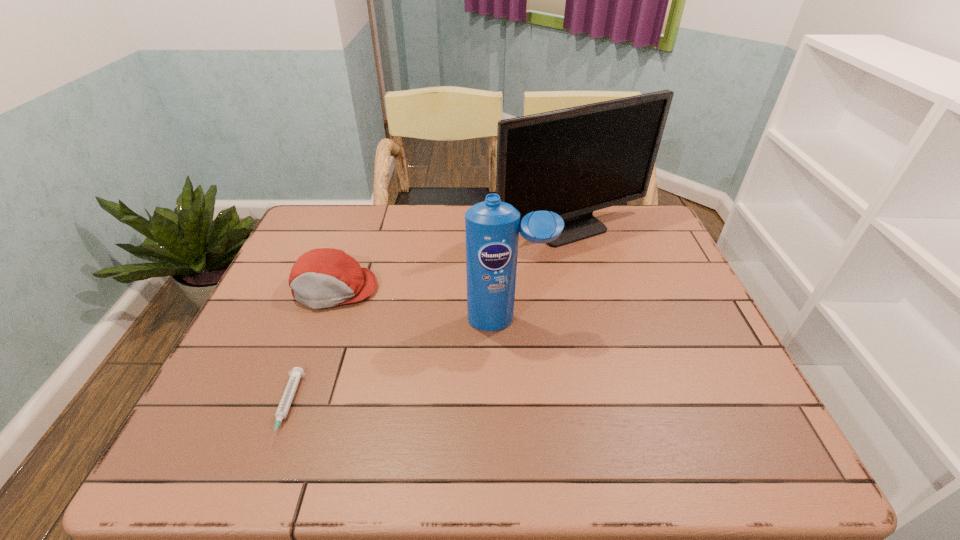
This screenshot has height=540, width=960. In order to click on computer monitor in this screenshot , I will do `click(573, 161)`.

Identify the location of shampoo. (492, 229).

Where is `the second shortest object`? The width and height of the screenshot is (960, 540). the second shortest object is located at coordinates (324, 277).

The width and height of the screenshot is (960, 540). In order to click on the shortest object in this screenshot , I will do `click(297, 372)`.

What are the coordinates of `the nearest object` in the screenshot? It's located at (297, 372).

Locate an element on the screen. vacant region located on the front-facing side of the computer monitor is located at coordinates (588, 287).

Locate an element on the screen. The height and width of the screenshot is (540, 960). free space located 0.110m on the right of the shampoo is located at coordinates tap(592, 321).

The width and height of the screenshot is (960, 540). In order to click on free space located on the front-facing side of the third tallest object in this screenshot , I will do `click(289, 417)`.

The image size is (960, 540). In order to click on object at the far edge in this screenshot , I will do `click(573, 161)`.

At what (x,y) coordinates should I click in order to perform the action: click on object present at the near edge. Please return your answer as a coordinate pair (x, y). The height and width of the screenshot is (540, 960). Looking at the image, I should click on (297, 372).